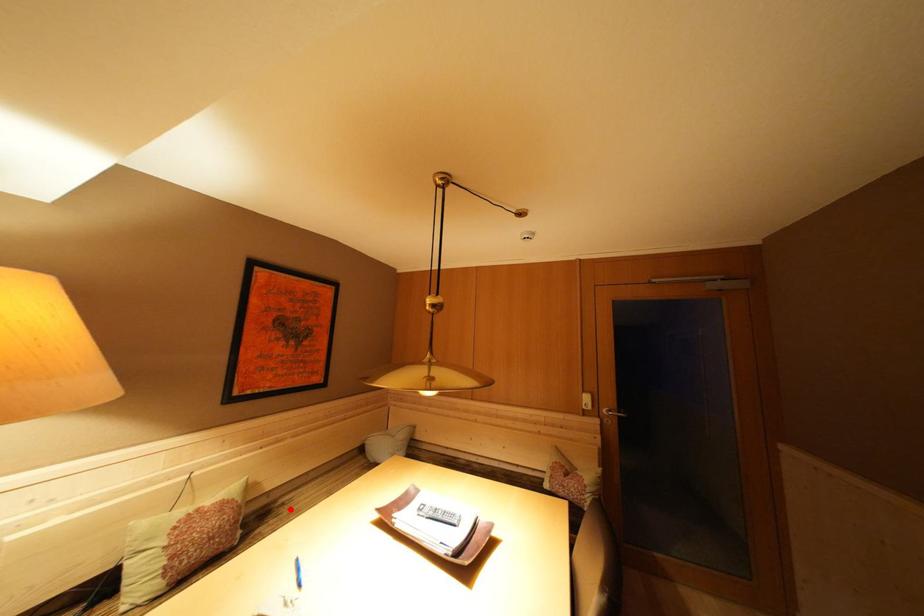
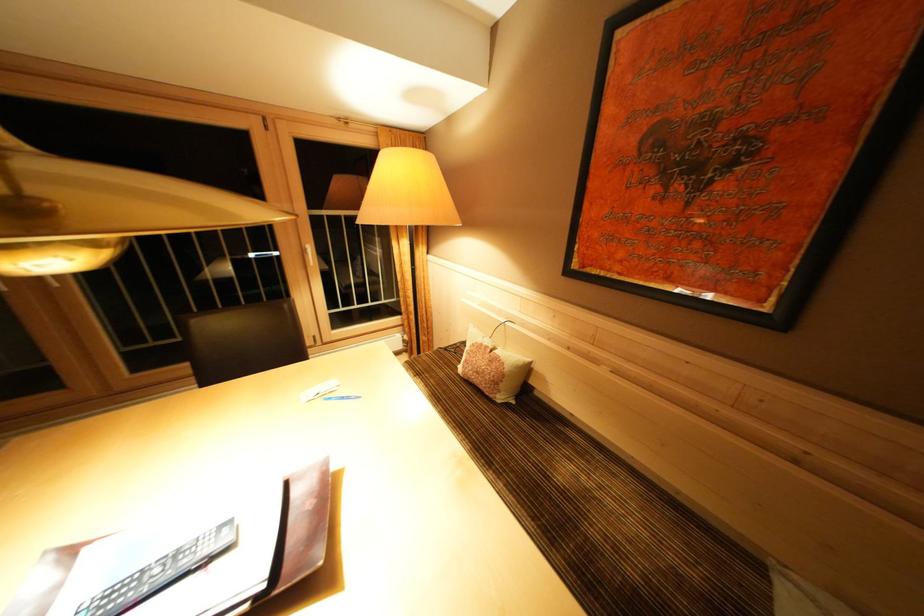
The point at the highlighted location is marked in the first image. Where is the corresponding point in the second image?

(565, 438)